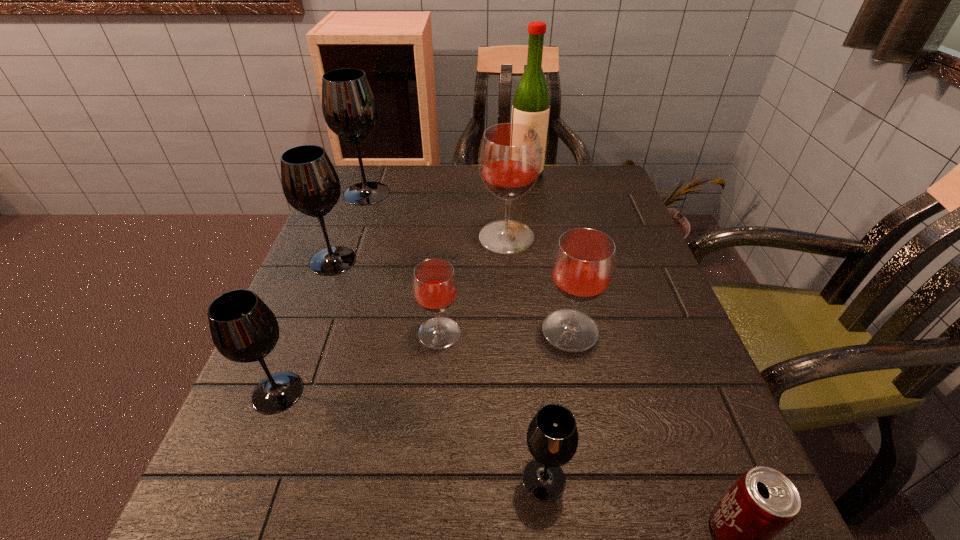
At what (x,y) coordinates should I click in order to perform the action: click on the fourth wineglass from right to left. Please return your answer as a coordinate pair (x, y). The height and width of the screenshot is (540, 960). Looking at the image, I should click on (435, 287).

You are a GUI agent. You are given a task and a screenshot of the screen. Output one action in this format:
    pyautogui.click(x=<x>, y=<y>)
    Task: Click on the nearest gray wineglass
    The width and height of the screenshot is (960, 540).
    Given the screenshot: What is the action you would take?
    pyautogui.click(x=552, y=437)

The width and height of the screenshot is (960, 540). In order to click on the rightmost gray wineglass in this screenshot , I will do `click(552, 437)`.

You are a GUI agent. You are given a task and a screenshot of the screen. Output one action in this format:
    pyautogui.click(x=<x>, y=<y>)
    Task: Click on the vacant space situated 0.080m on the label of the tallest object
    
    Given the screenshot: What is the action you would take?
    pyautogui.click(x=530, y=197)

In order to click on free space located on the front of the biggest gray wineglass in this screenshot , I will do `click(328, 299)`.

Locate an element on the screen. This screenshot has height=540, width=960. vacant area situated 0.130m on the front of the biggest red wineglass is located at coordinates (511, 295).

In order to click on free spot located on the front of the second biggest gray wineglass in this screenshot , I will do `click(268, 428)`.

Image resolution: width=960 pixels, height=540 pixels. What are the coordinates of `blank space located 0.070m on the back of the second biggest red wineglass` in the screenshot? It's located at (562, 286).

Locate an element on the screen. vacant space situated 0.290m on the back of the third biggest gray wineglass is located at coordinates (328, 262).

You are a GUI agent. You are given a task and a screenshot of the screen. Output one action in this format:
    pyautogui.click(x=<x>, y=<y>)
    Task: Click on the vacant region located 0.300m on the front of the fourth object from left to right
    
    Given the screenshot: What is the action you would take?
    pyautogui.click(x=421, y=534)